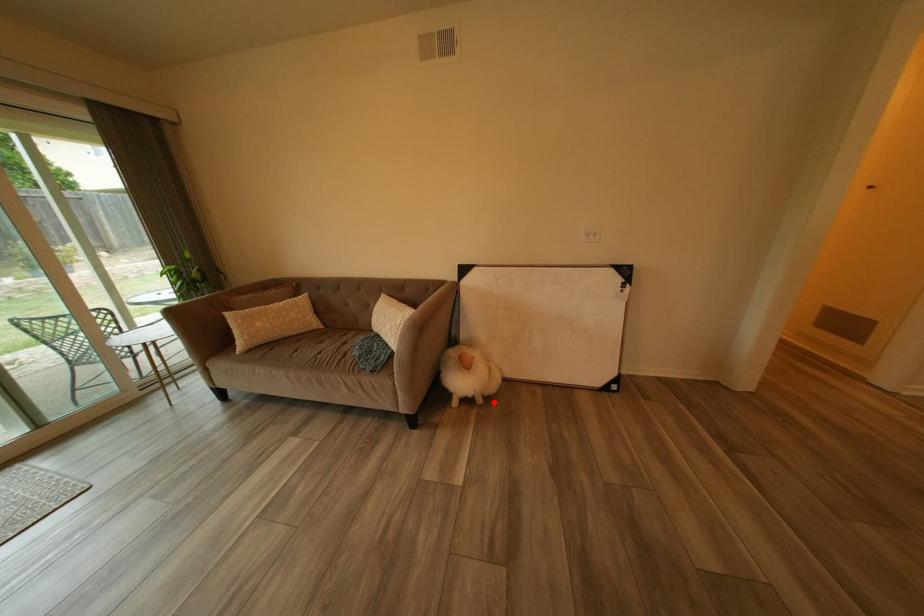
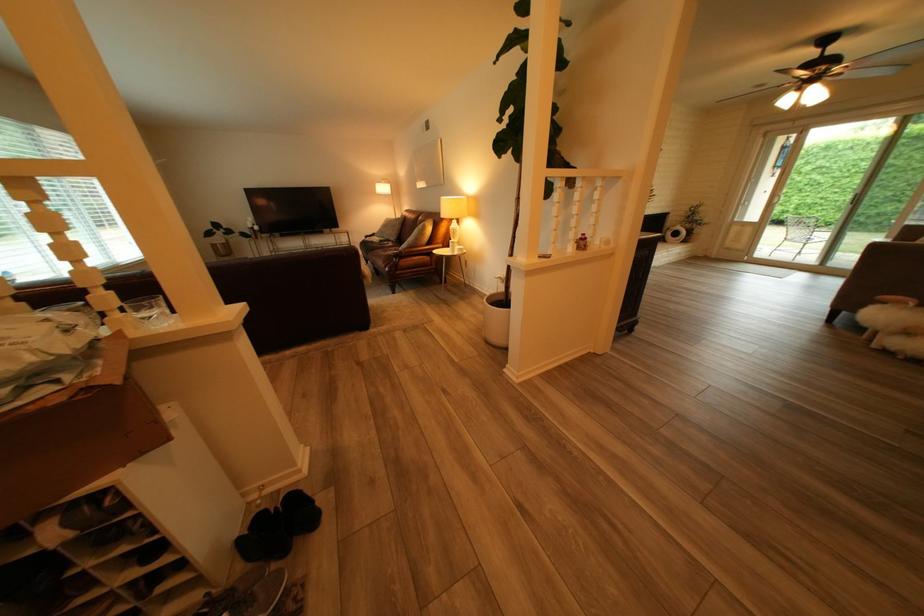
Locate, in the second image, the point that corresponds to the highlighted location in the first image.

(890, 346)